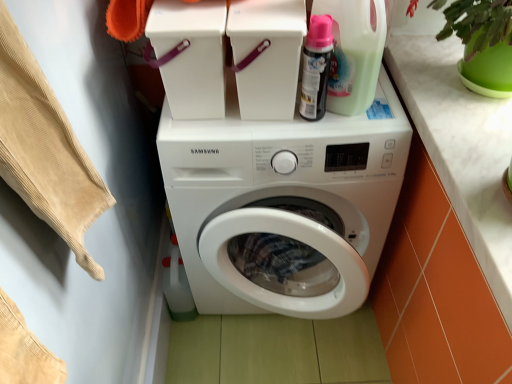
Question: Should I look upward or downward to see beige corduroy fabric at left?

Choices:
 (A) up
 (B) down

Answer: (B)

Question: Is the position of white marble countertop at upper right less distant than that of translucent plastic detergent bottle at upper right, the 1th cleaning product in the right-to-left sequence?

Choices:
 (A) no
 (B) yes

Answer: (B)

Question: From the image's perspective, is white marble countertop at upper right located beneath translucent plastic detergent bottle at upper right, the 1th cleaning product in the right-to-left sequence?

Choices:
 (A) no
 (B) yes

Answer: (B)

Question: From a real-world perspective, is white marble countertop at upper right on translucent plastic detergent bottle at upper right, the 1th cleaning product in the right-to-left sequence?

Choices:
 (A) yes
 (B) no

Answer: (B)

Question: Is white marble countertop at upper right oriented towards translucent plastic detergent bottle at upper right, arranged as the 2th cleaning product when viewed from the left?

Choices:
 (A) no
 (B) yes

Answer: (A)

Question: Considering the relative sizes of white marble countertop at upper right and translucent plastic detergent bottle at upper right, the 1th cleaning product in the right-to-left sequence, in the image provided, is white marble countertop at upper right taller than translucent plastic detergent bottle at upper right, the 1th cleaning product in the right-to-left sequence,?

Choices:
 (A) yes
 (B) no

Answer: (B)

Question: Considering the relative positions of white marble countertop at upper right and translucent plastic detergent bottle at upper right, the 1th cleaning product in the right-to-left sequence, in the image provided, is white marble countertop at upper right to the right of translucent plastic detergent bottle at upper right, the 1th cleaning product in the right-to-left sequence, from the viewer's perspective?

Choices:
 (A) no
 (B) yes

Answer: (B)

Question: From the image's perspective, is beige corduroy fabric at left above white plastic container at upper center?

Choices:
 (A) no
 (B) yes

Answer: (A)

Question: Could you tell me if beige corduroy fabric at left is facing white plastic container at upper center?

Choices:
 (A) no
 (B) yes

Answer: (A)

Question: Is beige corduroy fabric at left in contact with white plastic container at upper center?

Choices:
 (A) yes
 (B) no

Answer: (B)

Question: Does beige corduroy fabric at left appear on the right side of white plastic container at upper center?

Choices:
 (A) no
 (B) yes

Answer: (A)

Question: Does beige corduroy fabric at left have a greater height compared to white plastic container at upper center?

Choices:
 (A) yes
 (B) no

Answer: (A)

Question: Is white plastic container at upper center inside beige corduroy fabric at left?

Choices:
 (A) yes
 (B) no

Answer: (B)

Question: Considering the relative sizes of white marble countertop at upper right and white plastic container at upper center in the image provided, is white marble countertop at upper right thinner than white plastic container at upper center?

Choices:
 (A) no
 (B) yes

Answer: (A)